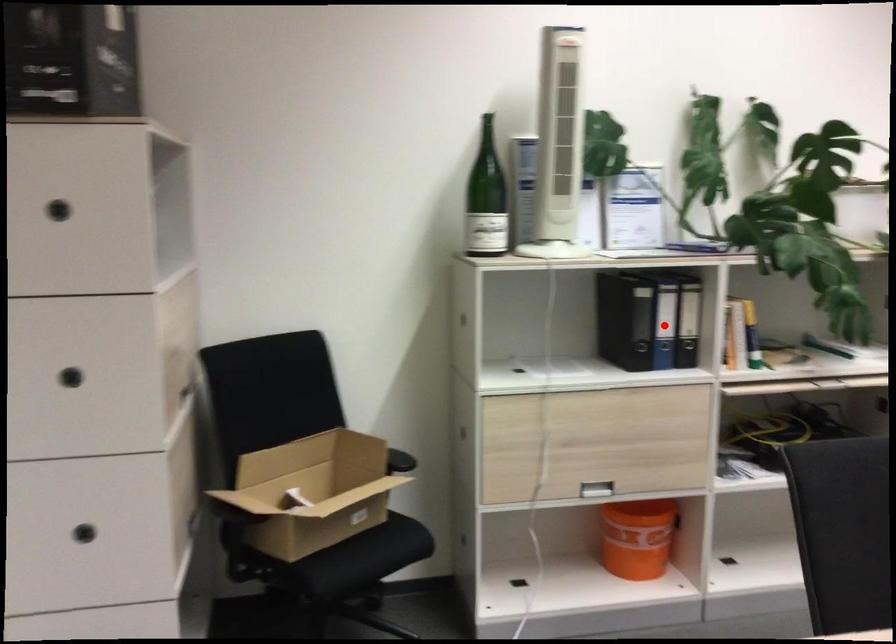
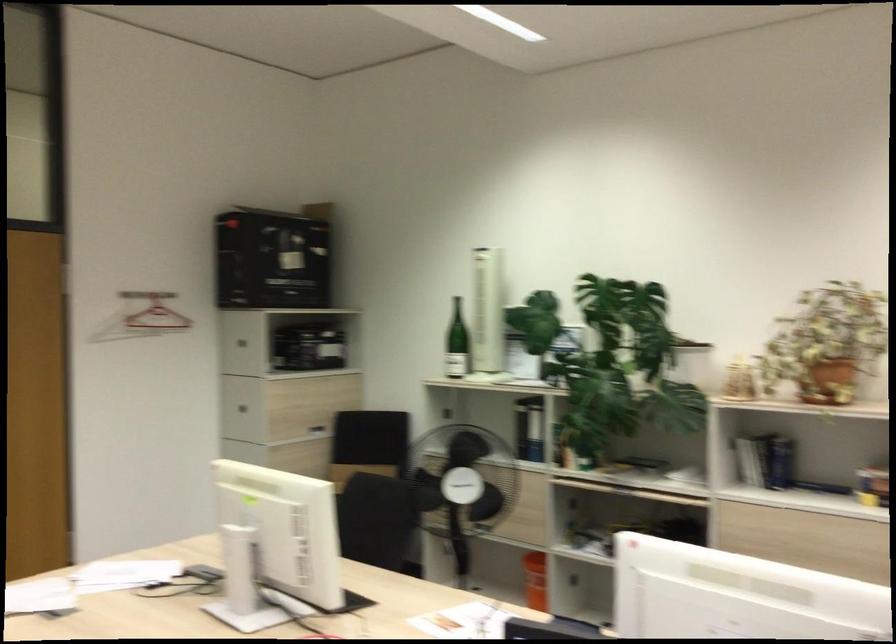
Question: I am providing you with two images of the same scene from different viewpoints. A red point is marked on the first image. At the location where the point appears in image 1, is it still visible in image 2?

Choices:
 (A) Yes
 (B) No

Answer: (B)